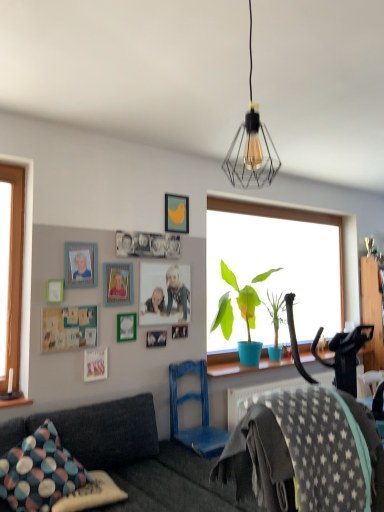
Question: Are multicolored fabric pillow at lower left, arranged as the second pillow when ordered from the bottom, and yellow matte picture frame at upper center, which is the tenth picture frame from bottom to top, making contact?

Choices:
 (A) no
 (B) yes

Answer: (A)

Question: Is multicolored fabric pillow at lower left, arranged as the second pillow when ordered from the bottom, wider than yellow matte picture frame at upper center, which appears as the first picture frame when viewed from the top?

Choices:
 (A) no
 (B) yes

Answer: (B)

Question: From a real-world perspective, is multicolored fabric pillow at lower left, the first pillow viewed from the top, on yellow matte picture frame at upper center, which is the tenth picture frame from bottom to top?

Choices:
 (A) no
 (B) yes

Answer: (A)

Question: Does multicolored fabric pillow at lower left, arranged as the second pillow when ordered from the bottom, turn towards yellow matte picture frame at upper center, which is the tenth picture frame from bottom to top?

Choices:
 (A) no
 (B) yes

Answer: (A)

Question: Is multicolored fabric pillow at lower left, the first pillow viewed from the top, positioned behind yellow matte picture frame at upper center, which appears as the first picture frame when viewed from the top?

Choices:
 (A) no
 (B) yes

Answer: (A)

Question: From a real-world perspective, is blue matte plant pot at window above or below green matte picture frame at upper center, acting as the fourth picture frame starting from the bottom?

Choices:
 (A) below
 (B) above

Answer: (B)

Question: Would you say blue matte plant pot at window is inside or outside green matte picture frame at upper center, the 7th picture frame viewed from the top?

Choices:
 (A) outside
 (B) inside

Answer: (A)

Question: From the image's perspective, is blue matte plant pot at window located above or below green matte picture frame at upper center, acting as the fourth picture frame starting from the bottom?

Choices:
 (A) below
 (B) above

Answer: (B)

Question: Is point tap(251, 300) positioned closer to the camera than point tap(129, 316)?

Choices:
 (A) closer
 (B) farther

Answer: (B)

Question: Is matte wooden picture frame at upper center, the 1th picture frame in the bottom-to-top sequence, wider or thinner than green matte picture frame at upper center, the 7th picture frame viewed from the top?

Choices:
 (A) thin
 (B) wide

Answer: (B)

Question: Is matte wooden picture frame at upper center, positioned as the tenth picture frame in top-to-bottom order, situated inside green matte picture frame at upper center, the 7th picture frame viewed from the top, or outside?

Choices:
 (A) inside
 (B) outside

Answer: (B)

Question: Relative to green matte picture frame at upper center, the 7th picture frame viewed from the top, is matte wooden picture frame at upper center, positioned as the tenth picture frame in top-to-bottom order, in front or behind?

Choices:
 (A) behind
 (B) front

Answer: (B)

Question: From a real-world perspective, is matte wooden picture frame at upper center, the 1th picture frame in the bottom-to-top sequence, above or below green matte picture frame at upper center, acting as the fourth picture frame starting from the bottom?

Choices:
 (A) above
 (B) below

Answer: (B)

Question: Is gray star-patterned fabric at lower right to the left or to the right of wooden photo frame at center, placed as the 8th picture frame when sorted from top to bottom, in the image?

Choices:
 (A) left
 (B) right

Answer: (B)

Question: Relative to wooden photo frame at center, placed as the 8th picture frame when sorted from top to bottom, is gray star-patterned fabric at lower right in front or behind?

Choices:
 (A) front
 (B) behind

Answer: (A)